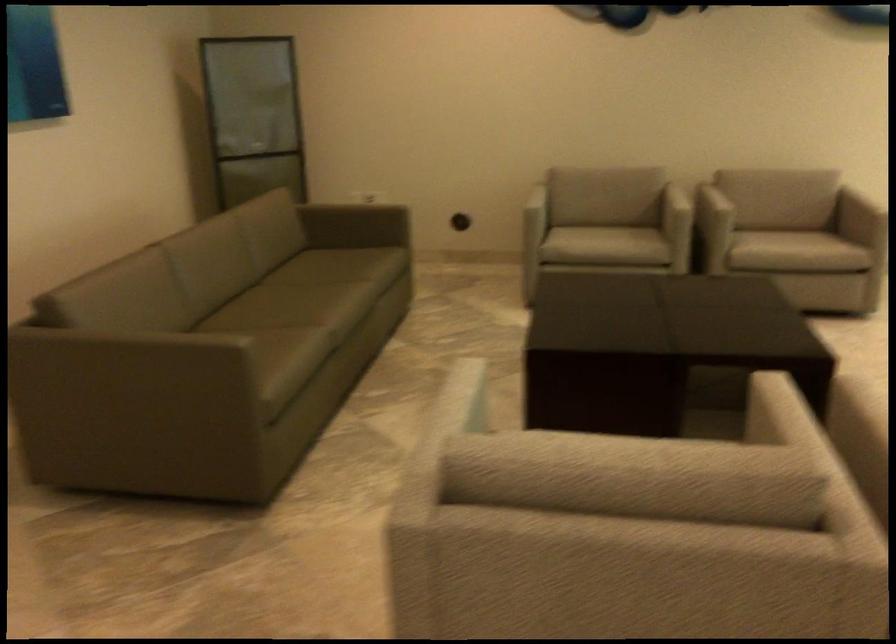
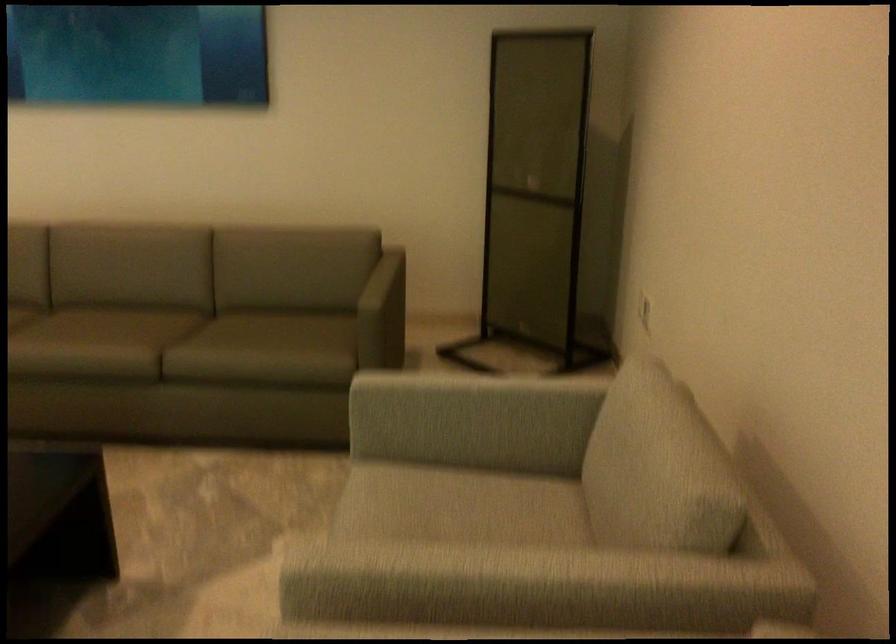
In the second image, find the point that corresponds to [280,145] in the first image.

(536, 194)